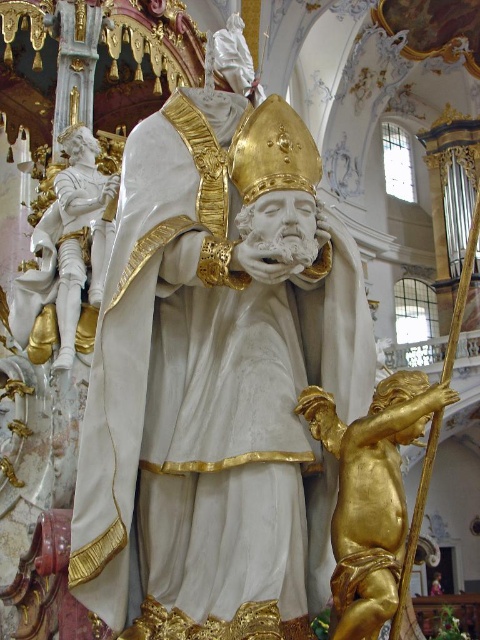
Who is taller, white marble statue at center or white glossy statue at left?

Standing taller between the two is white marble statue at center.

The height and width of the screenshot is (640, 480). Describe the element at coordinates (216, 372) in the screenshot. I see `white marble statue at center` at that location.

Locate an element on the screen. This screenshot has width=480, height=640. white marble statue at center is located at coordinates (216, 372).

Does point (398, 547) lie in front of point (57, 209)?

Yes, point (398, 547) is in front of point (57, 209).

Is point (365, 573) farther from viewer compared to point (99, 273)?

That is False.

Measure the distance between gold polished cherub at lower right and camera.

gold polished cherub at lower right and camera are 15.37 meters apart.

Image resolution: width=480 pixels, height=640 pixels. I want to click on gold polished cherub at lower right, so click(371, 493).

Is point (273, 264) less distant than point (371, 625)?

That is False.

Can you confirm if white marble statue at center is smaller than gold polished cherub at lower right?

Incorrect, white marble statue at center is not smaller in size than gold polished cherub at lower right.

Does point (325, 509) lie in front of point (346, 444)?

No, it is not.

This screenshot has width=480, height=640. What are the coordinates of `white marble statue at center` in the screenshot? It's located at (216, 372).